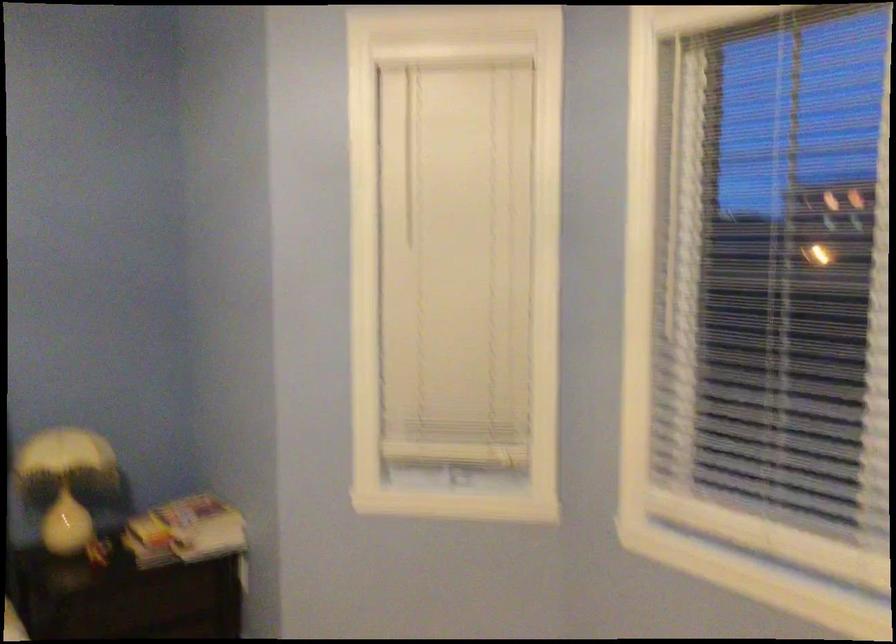
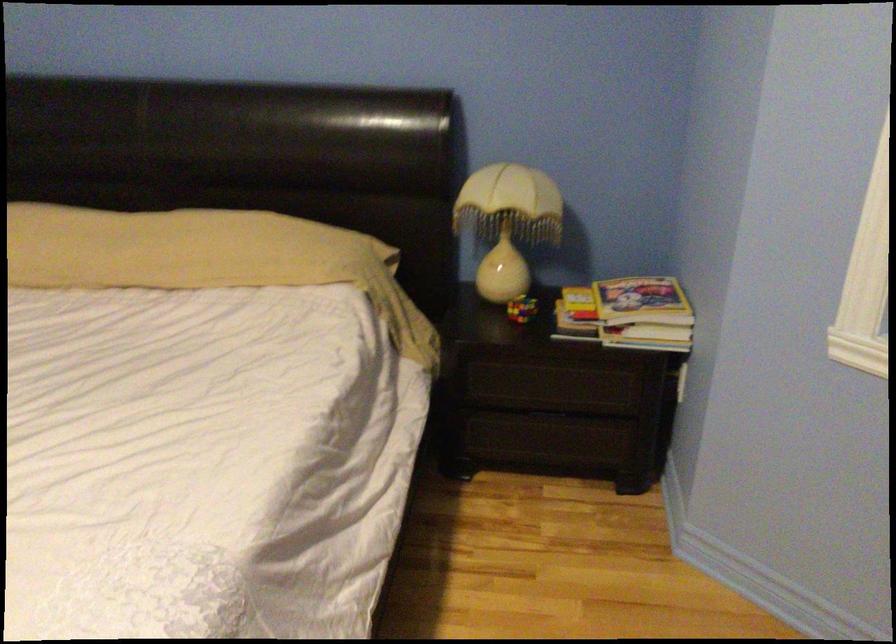
Locate, in the second image, the point that corresponds to pixel 106 547 in the first image.

(521, 308)